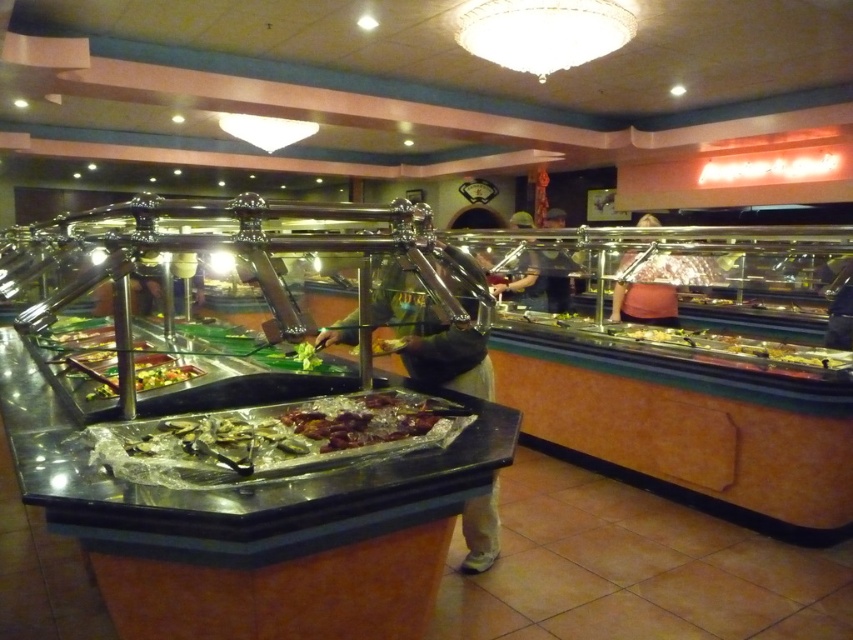
You are a food server who needs to place a 24 inch long platter between the shiny metallic meat at center and the green leafy vegetables at center. Can you fit it there without overlapping either of them?

The distance between the shiny metallic meat at center and the green leafy vegetables at center is 25.71 inches. Since the platter is 24 inches long, it can fit between them without overlapping either object.

You are a customer at the buffet and want to take a photo of both the shiny metallic meat at center and the green leafy vegetables at center. Since you want to capture both items in the same frame, which one should you focus on first to ensure both are visible?

You should focus on the green leafy vegetables at center first because the shiny metallic meat at center is located below it. By centering your camera on the green leafy vegetables at center, you can adjust your angle to include the shiny metallic meat at center positioned beneath it in the frame.

In the scene shown: You are a customer at the buffet and want to grab both the shiny metallic meat at center and the green leafy vegetables at center. Which one should you reach for first if you want to pick up the closest item first?

The shiny metallic meat at center is closer to the viewer than the green leafy vegetables at center, so you should reach for the shiny metallic meat at center first.